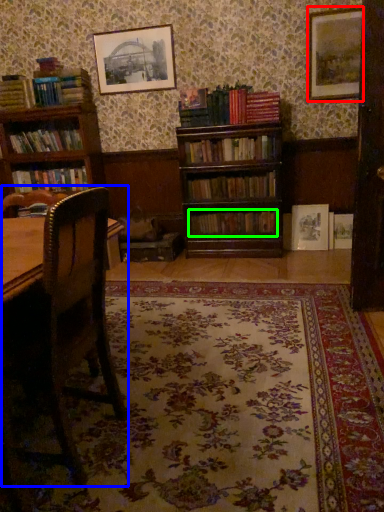
Question: Which is farther away from picture frame (highlighted by a red box)? rocking chair (highlighted by a blue box) or book (highlighted by a green box)?

Choices:
 (A) rocking chair
 (B) book

Answer: (A)